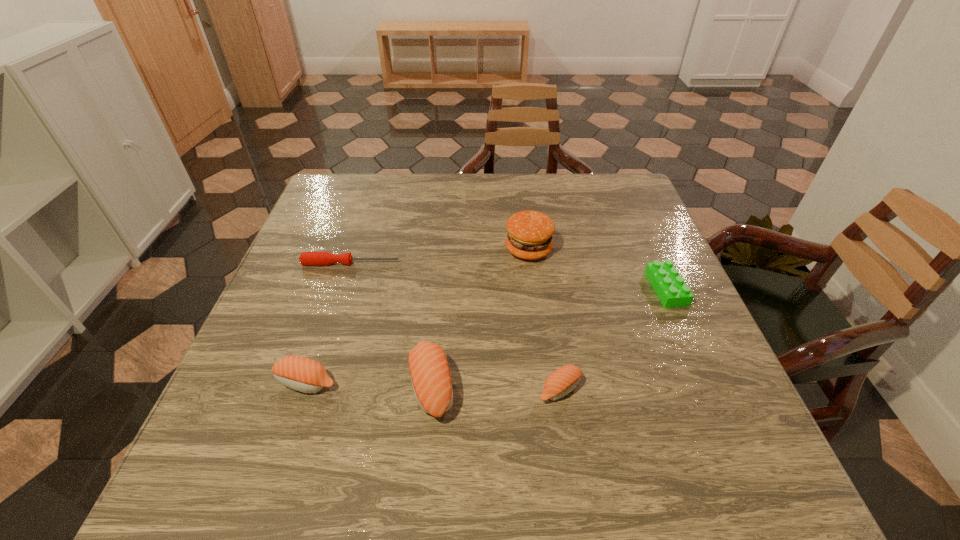
This screenshot has height=540, width=960. In the image, there is a desktop. In order to click on vacant area at the left edge in this screenshot , I will do pos(352,261).

Image resolution: width=960 pixels, height=540 pixels. Identify the location of vacant region at the right edge of the desktop. (631, 261).

This screenshot has height=540, width=960. Identify the location of free space at the far left corner of the desktop. click(x=361, y=186).

The height and width of the screenshot is (540, 960). In order to click on vacant space at the far right corner of the desktop in this screenshot , I will do `click(580, 180)`.

Image resolution: width=960 pixels, height=540 pixels. In order to click on free space at the near right corner of the desktop in this screenshot , I will do `click(734, 410)`.

Where is `free spot between the rightmost sushi and the third farthest object`? The image size is (960, 540). free spot between the rightmost sushi and the third farthest object is located at coordinates (613, 339).

Find the location of a particular element. The width and height of the screenshot is (960, 540). free area in between the Lego and the rightmost sushi is located at coordinates (613, 339).

Find the location of a particular element. Image resolution: width=960 pixels, height=540 pixels. empty location between the patty and the screwdriver is located at coordinates (440, 256).

Locate an element on the screen. The image size is (960, 540). empty space between the patty and the second shortest sushi is located at coordinates (418, 316).

Find the location of a particular element. unoccupied position between the Lego and the patty is located at coordinates (597, 269).